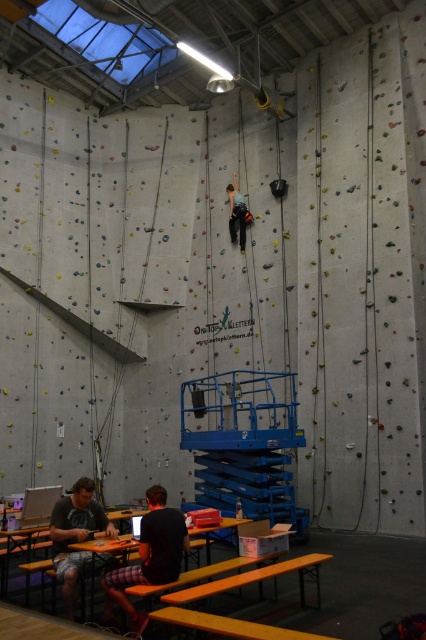
You are a GUI agent. You are given a task and a screenshot of the screen. Output one action in this format:
    pyautogui.click(x=<x>, y=<y>)
    Task: Click on the black cotton shirt at lower center
    The image size is (426, 640).
    Given the screenshot: What is the action you would take?
    pyautogui.click(x=150, y=554)

Who is more forward, (149, 509) or (233, 193)?

Point (149, 509)

Find the location of `black cotton shirt at lower center`. black cotton shirt at lower center is located at coordinates (150, 554).

Is black cotton shirt at lower center wider than gray cotton t-shirt at lower left?

Correct, the width of black cotton shirt at lower center exceeds that of gray cotton t-shirt at lower left.

Is point (154, 570) less distant than point (58, 522)?

Yes.

The image size is (426, 640). In order to click on black cotton shirt at lower center in this screenshot , I will do `click(150, 554)`.

Which is more to the left, gray cotton t-shirt at lower left or green fabric climbing harness at center?

gray cotton t-shirt at lower left

Can you confirm if gray cotton t-shirt at lower left is taller than green fabric climbing harness at center?

No, gray cotton t-shirt at lower left is not taller than green fabric climbing harness at center.

Locate an element on the screen. Image resolution: width=426 pixels, height=640 pixels. gray cotton t-shirt at lower left is located at coordinates (75, 536).

Where is `gray cotton t-shirt at lower left`? The image size is (426, 640). gray cotton t-shirt at lower left is located at coordinates (75, 536).